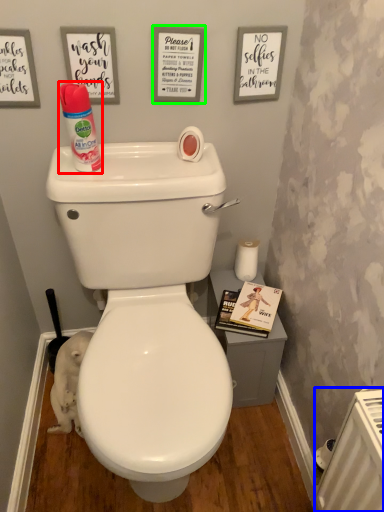
Question: Estimate the real-world distances between objects in this image. Which object is closer to cleaning product (highlighted by a red box), radiator (highlighted by a blue box) or copy (highlighted by a green box)?

Choices:
 (A) radiator
 (B) copy

Answer: (B)